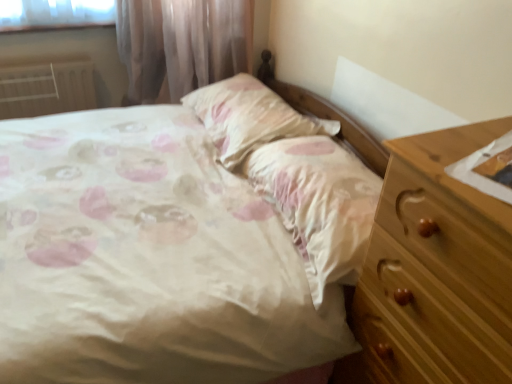
What do you see at coordinates (249, 117) in the screenshot?
I see `satin floral pillow at center` at bounding box center [249, 117].

Measure the distance between point (280,99) and camera.

They are 1.93 meters apart.

Identify the location of white painted metal radiator at left. This screenshot has height=384, width=512. (46, 85).

Where is `satin floral pillow at center`? The image size is (512, 384). satin floral pillow at center is located at coordinates (249, 117).

Is pink satin sheet at center positioned far away from satin floral pillow at center?

They are positioned close to each other.

From the image's perspective, does pink satin sheet at center appear higher than satin floral pillow at center?

No, from the image's perspective, pink satin sheet at center is not on top of satin floral pillow at center.

Can you tell me how much pink satin sheet at center and satin floral pillow at center differ in facing direction?

There is a 0.000368-degree angle between the facing directions of pink satin sheet at center and satin floral pillow at center.

Which object is positioned more to the right, pink satin sheet at center or satin floral pillow at center?

From the viewer's perspective, pink satin sheet at center appears more on the right side.

In the scene shown: From a real-world perspective, relative to satin floral pillow at center, is white painted metal radiator at left vertically above or below?

In terms of real-world spatial position, white painted metal radiator at left is below satin floral pillow at center.

Is white painted metal radiator at left not inside satin floral pillow at center?

Yes, white painted metal radiator at left is outside of satin floral pillow at center.

Which point is more distant from viewer, (63, 85) or (217, 134)?

The point (63, 85) is behind.

From the image's perspective, who appears lower, satin floral pillow at center or pink satin sheet at center?

pink satin sheet at center.

Who is shorter, satin floral pillow at center or pink satin sheet at center?

satin floral pillow at center is shorter.

Locate an element on the screen. Image resolution: width=512 pixels, height=384 pixels. sheet below the satin floral pillow at center (from a real-world perspective) is located at coordinates (319, 204).

Is satin floral pillow at center looking in the opposite direction of white painted metal radiator at left?

That's not correct — satin floral pillow at center is not looking away from white painted metal radiator at left.

Can you tell me how much satin floral pillow at center and white painted metal radiator at left differ in facing direction?

The angle between the facing direction of satin floral pillow at center and the facing direction of white painted metal radiator at left is 93 degrees.

Is satin floral pillow at center taller or shorter than white painted metal radiator at left?

Considering their sizes, satin floral pillow at center has less height than white painted metal radiator at left.

This screenshot has height=384, width=512. In order to click on radiator that is under the satin floral pillow at center (from a real-world perspective) in this screenshot , I will do `click(46, 85)`.

Would you say pink satin sheet at center is inside or outside white painted metal radiator at left?

The correct answer is: outside.

Locate an element on the screen. radiator on the left side of pink satin sheet at center is located at coordinates (46, 85).

Considering the sizes of objects pink satin sheet at center and white painted metal radiator at left in the image provided, who is smaller, pink satin sheet at center or white painted metal radiator at left?

white painted metal radiator at left is smaller.

Which of these two, pink satin sheet at center or white painted metal radiator at left, is wider?

pink satin sheet at center.

From the picture: Is white painted metal radiator at left inside the boundaries of pink satin sheet at center, or outside?

white painted metal radiator at left is not inside pink satin sheet at center, it's outside.

Which is more to the right, white painted metal radiator at left or pink satin sheet at center?

Positioned to the right is pink satin sheet at center.

In the scene shown: Is white painted metal radiator at left oriented away from pink satin sheet at center?

No, white painted metal radiator at left is not facing away from pink satin sheet at center.

From a real-world perspective, which is physically below, white painted metal radiator at left or pink satin sheet at center?

white painted metal radiator at left is physically lower.

Where is `sheet lying in front of the satin floral pillow at center`? This screenshot has width=512, height=384. sheet lying in front of the satin floral pillow at center is located at coordinates (319, 204).

I want to click on radiator below the satin floral pillow at center (from a real-world perspective), so click(x=46, y=85).

Estimate the real-world distances between objects in this image. Which object is further from satin floral pillow at center, pink satin sheet at center or white painted metal radiator at left?

Among the two, white painted metal radiator at left is located further to satin floral pillow at center.

Looking at the image, which one is located further to pink satin sheet at center, satin floral pillow at center or white painted metal radiator at left?

white painted metal radiator at left lies further to pink satin sheet at center than the other object.

Estimate the real-world distances between objects in this image. Which object is closer to white painted metal radiator at left, pink satin sheet at center or satin floral pillow at center?

The object closer to white painted metal radiator at left is satin floral pillow at center.

Estimate the real-world distances between objects in this image. Which object is closer to satin floral pillow at center, white painted metal radiator at left or pink satin sheet at center?

The object closer to satin floral pillow at center is pink satin sheet at center.

From the image, which object appears to be farther from white painted metal radiator at left, satin floral pillow at center or pink satin sheet at center?

Among the two, pink satin sheet at center is located further to white painted metal radiator at left.

From the image, which object appears to be nearer to pink satin sheet at center, white painted metal radiator at left or satin floral pillow at center?

satin floral pillow at center is closer to pink satin sheet at center.

I want to click on pillow situated between white painted metal radiator at left and pink satin sheet at center from left to right, so click(x=249, y=117).